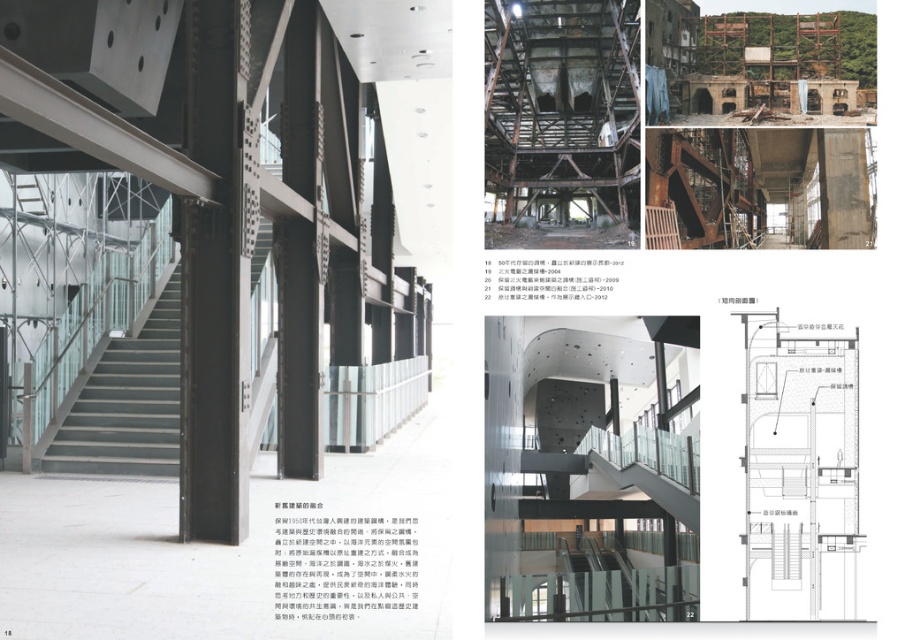
You are an architect reviewing the building design. You need to determine the vertical arrangement of the matte gray staircase at center and transparent glass stairs at center. Which one is positioned higher in the structure?

The matte gray staircase at center is positioned higher than the transparent glass stairs at center because it is located above them.

You are an architect designing a building with both a matte gray staircase at center and transparent glass stairs at center. Which staircase is shorter in height?

The matte gray staircase at center is shorter in height than the transparent glass stairs at center.